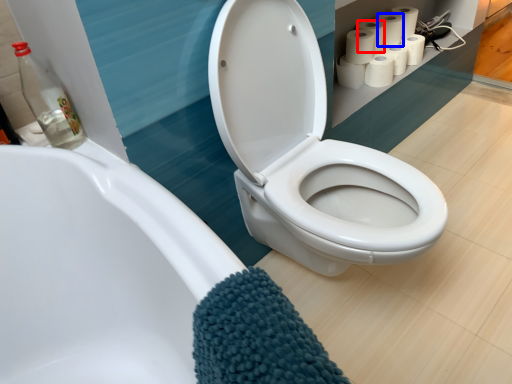
Question: Which of the following is the closest to the observer, toilet paper (highlighted by a red box) or toilet paper (highlighted by a blue box)?

Choices:
 (A) toilet paper
 (B) toilet paper

Answer: (A)